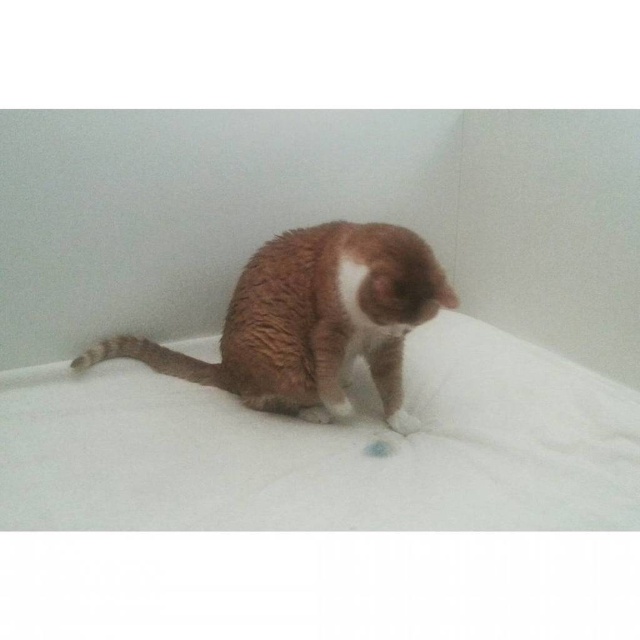
You are a veterinarian examining a cat and its paw. Based on the image provided, which object is bigger between the brown fur cat at center and the white fur paw at lower center?

The brown fur cat at center is larger in size compared to the white fur paw at lower center, so the brown fur cat at center is bigger.

You are standing in the room where the cat is sitting. The cat is at point (310, 320). If you want to approach the cat without stepping on any objects, where should you walk towards?

You should walk towards the brown fur cat at center located at point (310, 320) since there are no other objects mentioned in the scene besides the cat and the white surface, ensuring a clear path.